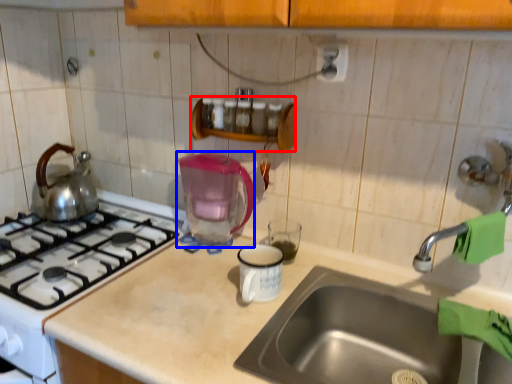
Question: Which object appears farthest to the camera in this image, shelf (highlighted by a red box) or coffeepot (highlighted by a blue box)?

Choices:
 (A) shelf
 (B) coffeepot

Answer: (A)